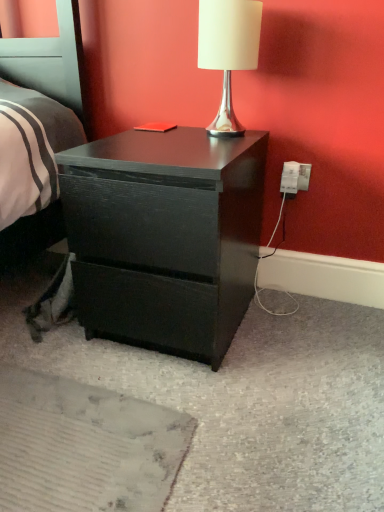
Question: Is matte black nightstand at center inside white plastic electric outlet at lower right?

Choices:
 (A) no
 (B) yes

Answer: (A)

Question: Is white plastic electric outlet at lower right to the right of matte black nightstand at center from the viewer's perspective?

Choices:
 (A) yes
 (B) no

Answer: (A)

Question: Could you tell me if white plastic electric outlet at lower right is facing matte black nightstand at center?

Choices:
 (A) no
 (B) yes

Answer: (A)

Question: Is white plastic electric outlet at lower right bigger than matte black nightstand at center?

Choices:
 (A) no
 (B) yes

Answer: (A)

Question: Is white plastic electric outlet at lower right turned away from matte black nightstand at center?

Choices:
 (A) no
 (B) yes

Answer: (A)

Question: In terms of size, does white plastic electric outlet at lower right appear bigger or smaller than matte black nightstand at center?

Choices:
 (A) big
 (B) small

Answer: (B)

Question: Does point (306, 189) appear closer or farther from the camera than point (127, 155)?

Choices:
 (A) farther
 (B) closer

Answer: (A)

Question: Looking at their shapes, would you say white plastic electric outlet at lower right is wider or thinner than matte black nightstand at center?

Choices:
 (A) thin
 (B) wide

Answer: (A)

Question: In the image, is white plastic electric outlet at lower right on the left side or the right side of matte black nightstand at center?

Choices:
 (A) left
 (B) right

Answer: (B)

Question: Would you say white plastic electric outlet at lower right is to the left or to the right of white glossy table lamp at upper center in the picture?

Choices:
 (A) left
 (B) right

Answer: (B)

Question: In terms of size, does white plastic electric outlet at lower right appear bigger or smaller than white glossy table lamp at upper center?

Choices:
 (A) big
 (B) small

Answer: (B)

Question: Does point (289, 192) appear closer or farther from the camera than point (203, 34)?

Choices:
 (A) farther
 (B) closer

Answer: (A)

Question: Is white plastic electric outlet at lower right in front of or behind white glossy table lamp at upper center in the image?

Choices:
 (A) behind
 (B) front

Answer: (A)

Question: Does point (183, 333) appear closer or farther from the camera than point (205, 44)?

Choices:
 (A) closer
 (B) farther

Answer: (B)

Question: From a real-world perspective, is matte black nightstand at center positioned above or below white glossy table lamp at upper center?

Choices:
 (A) below
 (B) above

Answer: (A)